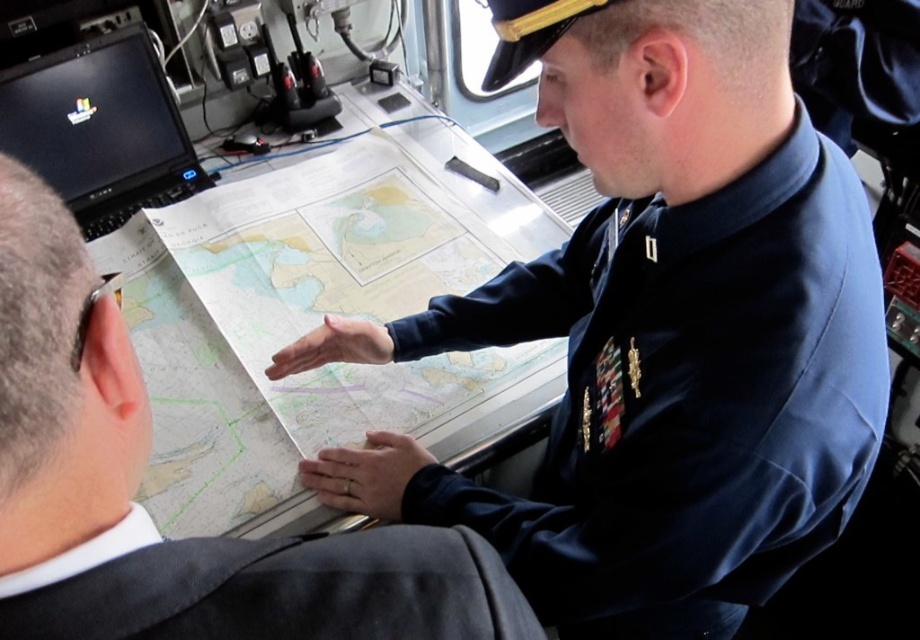
Is gray fabric suit at lower left below black glossy laptop at upper left?

Yes.

Is gray fabric suit at lower left wider than black glossy laptop at upper left?

Incorrect, gray fabric suit at lower left's width does not surpass black glossy laptop at upper left's.

Is point (397, 620) farther from camera compared to point (168, 172)?

No, (397, 620) is closer to viewer.

Identify the location of gray fabric suit at lower left. (268, 588).

Consider the image. Who is more forward, (x=542, y=86) or (x=335, y=422)?

Point (x=542, y=86) is in front.

Who is more forward, (700,561) or (192,228)?

Point (700,561) is more forward.

I want to click on blue uniform at center, so click(x=658, y=330).

Does blue uniform at center have a lesser height compared to gray fabric suit at lower left?

Incorrect, blue uniform at center's height does not fall short of gray fabric suit at lower left's.

Is blue uniform at center above gray fabric suit at lower left?

Indeed, blue uniform at center is positioned over gray fabric suit at lower left.

Is point (705, 380) behind point (196, 625)?

That is True.

Find the location of a particular element. The image size is (920, 640). blue uniform at center is located at coordinates (658, 330).